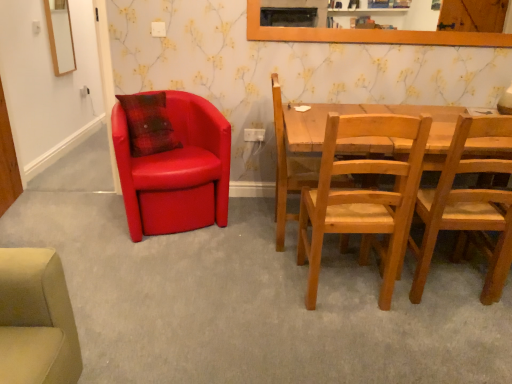
Question: In which direction should I rotate to look at natural wood chair at center, placed as the second chair when sorted from right to left?

Choices:
 (A) left
 (B) right

Answer: (B)

Question: From a real-world perspective, is matte leather chair at left, the 4th chair from the right, located higher than wooden chair at center, positioned as the 3th chair in right-to-left order?

Choices:
 (A) no
 (B) yes

Answer: (A)

Question: Is matte leather chair at left, the 4th chair from the right, in contact with wooden chair at center, arranged as the 2th chair when viewed from the left?

Choices:
 (A) no
 (B) yes

Answer: (A)

Question: Considering the relative positions of matte leather chair at left, the 4th chair from the right, and wooden chair at center, positioned as the 3th chair in right-to-left order, in the image provided, is matte leather chair at left, the 4th chair from the right, in front of wooden chair at center, positioned as the 3th chair in right-to-left order,?

Choices:
 (A) yes
 (B) no

Answer: (B)

Question: Is matte leather chair at left, the 4th chair from the right, further to the viewer compared to wooden chair at center, arranged as the 2th chair when viewed from the left?

Choices:
 (A) yes
 (B) no

Answer: (A)

Question: Can you confirm if matte leather chair at left, which appears as the 1th chair when viewed from the left, is wider than wooden chair at center, arranged as the 2th chair when viewed from the left?

Choices:
 (A) yes
 (B) no

Answer: (A)

Question: Can you confirm if matte leather chair at left, the 4th chair from the right, is taller than wooden chair at center, arranged as the 2th chair when viewed from the left?

Choices:
 (A) yes
 (B) no

Answer: (B)

Question: Would you say white plastic power outlet at upper center, which appears as the second power outlet when viewed from the right, is outside wooden-framed mirror at upper left?

Choices:
 (A) yes
 (B) no

Answer: (A)

Question: Is white plastic power outlet at upper center, which is the second power outlet in back-to-front order, bigger than wooden-framed mirror at upper left?

Choices:
 (A) yes
 (B) no

Answer: (B)

Question: Can wooden-framed mirror at upper left be found inside white plastic power outlet at upper center, the second power outlet when ordered from bottom to top?

Choices:
 (A) yes
 (B) no

Answer: (B)

Question: Considering the relative sizes of white plastic power outlet at upper center, the 1th power outlet positioned from the left, and wooden-framed mirror at upper left in the image provided, is white plastic power outlet at upper center, the 1th power outlet positioned from the left, smaller than wooden-framed mirror at upper left?

Choices:
 (A) yes
 (B) no

Answer: (A)

Question: From the image's perspective, does white plastic power outlet at upper center, the second power outlet when ordered from bottom to top, appear lower than wooden-framed mirror at upper left?

Choices:
 (A) no
 (B) yes

Answer: (B)

Question: Is the depth of white plastic power outlet at upper center, which appears as the second power outlet when viewed from the right, less than that of wooden-framed mirror at upper left?

Choices:
 (A) no
 (B) yes

Answer: (B)

Question: Would you say matte leather chair at left, the 4th chair from the right, is part of white plastic power outlet at lower center, positioned as the 1th power outlet in right-to-left order,'s contents?

Choices:
 (A) yes
 (B) no

Answer: (B)